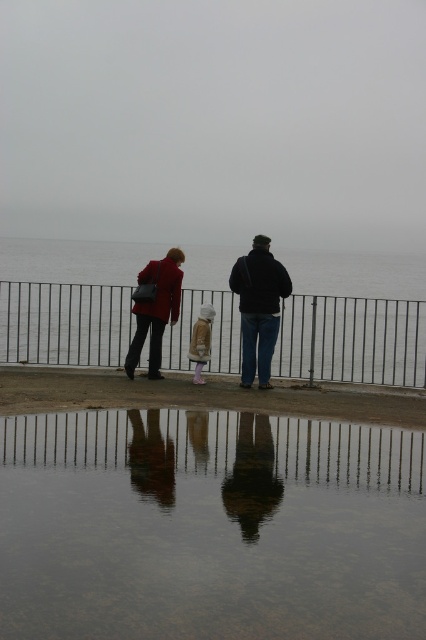
Between clear water at center and matte black jacket at center, which one has less height?

clear water at center is shorter.

What do you see at coordinates (210, 525) in the screenshot? I see `clear water at center` at bounding box center [210, 525].

The image size is (426, 640). Identify the location of clear water at center. (210, 525).

Is black metal fence at center taller than matte black coat at left?

No, black metal fence at center is not taller than matte black coat at left.

Image resolution: width=426 pixels, height=640 pixels. In order to click on black metal fence at center in this screenshot , I will do `click(351, 340)`.

What do you see at coordinates (351, 340) in the screenshot? I see `black metal fence at center` at bounding box center [351, 340].

I want to click on black metal fence at center, so click(x=351, y=340).

Is black metal fence at center bigger than smooth concrete surface at center?

Incorrect, black metal fence at center is not larger than smooth concrete surface at center.

Who is more forward, (x=89, y=349) or (x=219, y=387)?

Point (x=219, y=387) is in front.

What are the coordinates of `black metal fence at center` in the screenshot? It's located at (351, 340).